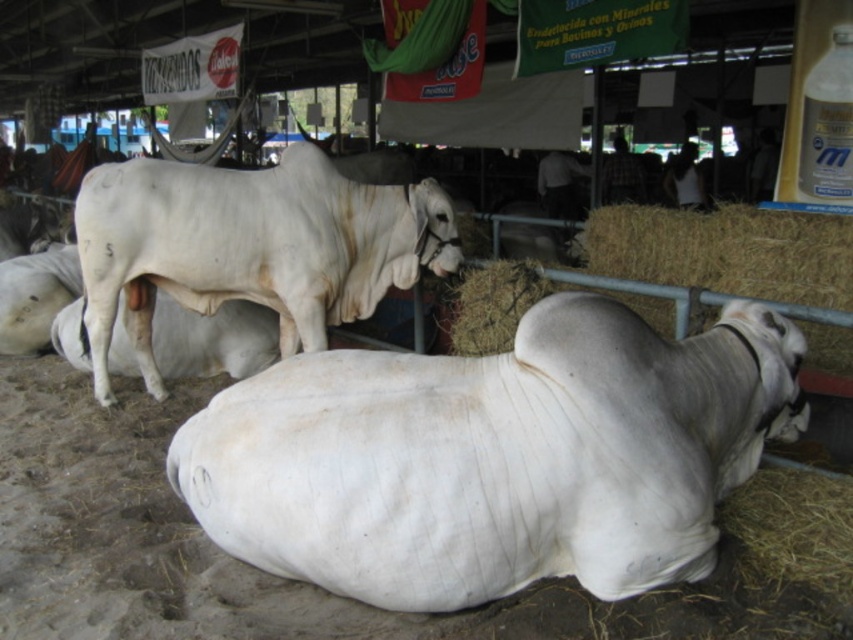
Question: Which object is farther from the camera taking this photo?

Choices:
 (A) white smooth cow at lower center
 (B) white smooth bull at upper center

Answer: (B)

Question: Which of the following is the farthest from the observer?

Choices:
 (A) white smooth cow at lower center
 (B) white smooth bull at upper center

Answer: (B)

Question: Considering the relative positions of white smooth cow at lower center and white smooth bull at upper center in the image provided, where is white smooth cow at lower center located with respect to white smooth bull at upper center?

Choices:
 (A) below
 (B) above

Answer: (A)

Question: Does white smooth cow at lower center have a larger size compared to white smooth bull at upper center?

Choices:
 (A) yes
 (B) no

Answer: (B)

Question: Can you confirm if white smooth cow at lower center is thinner than white smooth bull at upper center?

Choices:
 (A) yes
 (B) no

Answer: (A)

Question: Which point is closer to the camera taking this photo?

Choices:
 (A) (564, 522)
 (B) (137, 182)

Answer: (A)